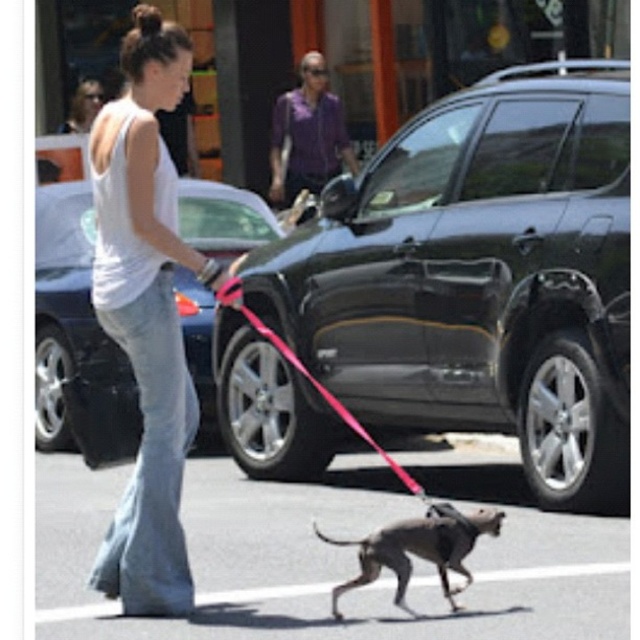
You are a pedestrian trying to cross the street where the shiny black car at center and the pink nylon leash at center are located. Which object would you need to be cautious of first while crossing?

The pink nylon leash at center is behind the shiny black car at center, so you should be cautious of the shiny black car at center first as it is closer to your path when crossing the street.

You are a photographer trying to capture the woman and her dog in the image. You notice two points in the scene at coordinates point (360, 538) and point (397, 474). Which point should you focus on to ensure the subject is in sharp focus if the woman is the main subject?

You should focus on point (360, 538) because it is closer to the camera than point (397, 474), ensuring the woman, who is the main subject, is in sharp focus.